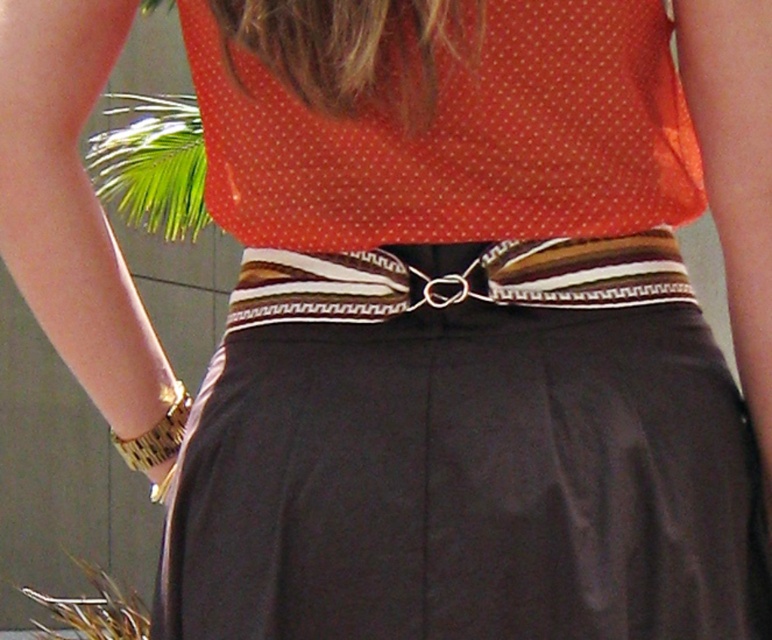
You are a fashion designer analyzing the outfit. The orange dotted fabric at upper center is represented by point (461, 138). Is this point closer to the top of the outfit or the bottom?

The orange dotted fabric at upper center is represented by point (461, 138). Since the y coordinate is 0.598, which is closer to 1.0 than 0.0, the point is closer to the bottom of the outfit.

You are a fashion designer reviewing a client outfit. The client has a striped fabric belt at center and a gold metallic bracelet at lower left. Based on the outfit shown, which accessory is positioned closer to the viewer?

The striped fabric belt at center is positioned closer to the viewer because it is in front of the gold metallic bracelet at lower left.

You are a fashion designer observing the outfit. You need to determine the distance between the orange dotted fabric at upper center and the belt with decorative pattern. Which is closer to the viewer?

The orange dotted fabric at upper center is closer to the viewer than the belt with decorative pattern because the orange dotted fabric at upper center is 38.86 inches from viewer.